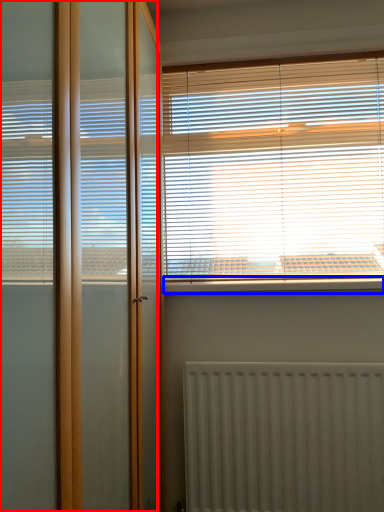
Question: Which object is further to the camera taking this photo, screen door (highlighted by a red box) or window sill (highlighted by a blue box)?

Choices:
 (A) screen door
 (B) window sill

Answer: (B)